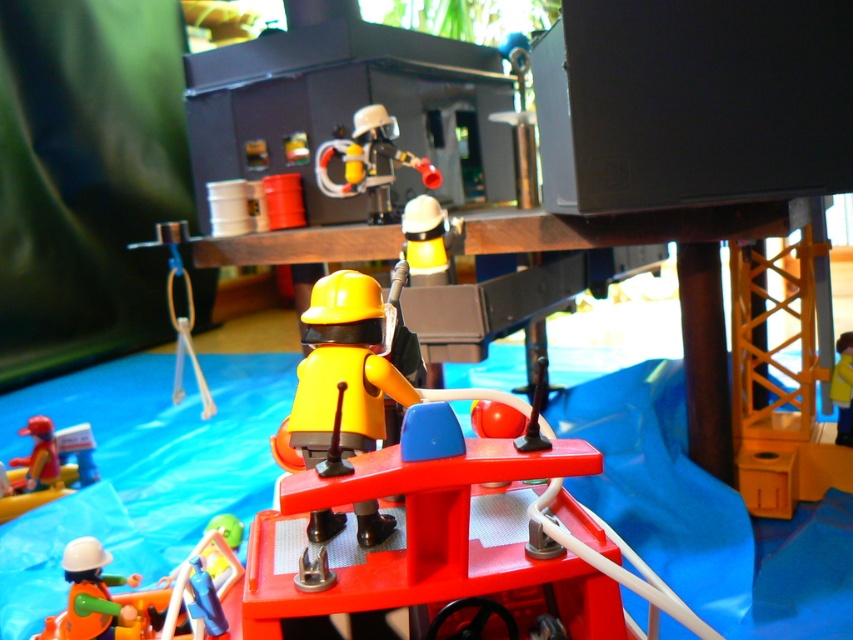
Question: Can you confirm if orange matte life vest at lower left is bigger than yellow plastic ladder at center?

Choices:
 (A) yes
 (B) no

Answer: (A)

Question: Is matte red helmet at lower left smaller than yellow plastic ladder at center?

Choices:
 (A) no
 (B) yes

Answer: (A)

Question: Among these objects, which one is farthest from the camera?

Choices:
 (A) matte yellow helmet at center
 (B) yellow plastic ladder at center
 (C) smooth plastic fire extinguisher at upper center
 (D) orange matte life vest at lower left

Answer: (C)

Question: Is smooth plastic fire extinguisher at upper center positioned at the back of yellow matte helmet at upper center?

Choices:
 (A) no
 (B) yes

Answer: (B)

Question: Which of the following is the closest to the observer?

Choices:
 (A) (367, 141)
 (B) (440, 216)

Answer: (B)

Question: Among these objects, which one is nearest to the camera?

Choices:
 (A) matte yellow helmet at center
 (B) smooth plastic fire extinguisher at upper center

Answer: (A)